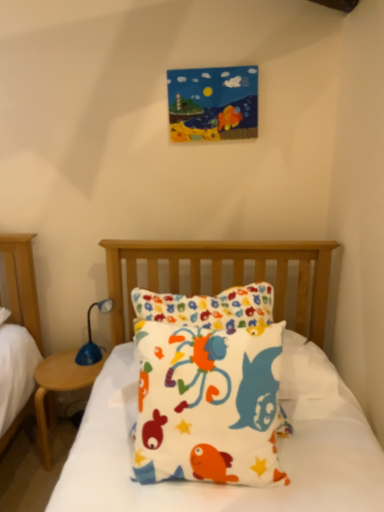
Question: From a real-world perspective, does wooden at left stand above blue plastic table lamp at left?

Choices:
 (A) no
 (B) yes

Answer: (A)

Question: Is wooden at left outside of blue plastic table lamp at left?

Choices:
 (A) no
 (B) yes

Answer: (B)

Question: Is wooden at left not close to blue plastic table lamp at left?

Choices:
 (A) yes
 (B) no

Answer: (B)

Question: Is blue plastic table lamp at left completely or partially inside wooden at left?

Choices:
 (A) yes
 (B) no

Answer: (B)

Question: Does wooden at left come behind blue plastic table lamp at left?

Choices:
 (A) no
 (B) yes

Answer: (A)

Question: Is wooden at left facing away from blue plastic table lamp at left?

Choices:
 (A) yes
 (B) no

Answer: (B)

Question: Is fluffy cotton pillow at center at the right side of wooden at left?

Choices:
 (A) no
 (B) yes

Answer: (B)

Question: Is fluffy cotton pillow at center positioned with its back to wooden at left?

Choices:
 (A) no
 (B) yes

Answer: (A)

Question: Is fluffy cotton pillow at center outside wooden at left?

Choices:
 (A) yes
 (B) no

Answer: (A)

Question: From a real-world perspective, is fluffy cotton pillow at center positioned over wooden at left based on gravity?

Choices:
 (A) no
 (B) yes

Answer: (B)

Question: Is fluffy cotton pillow at center taller than wooden at left?

Choices:
 (A) yes
 (B) no

Answer: (A)

Question: Does fluffy cotton pillow at center appear on the left side of wooden at left?

Choices:
 (A) no
 (B) yes

Answer: (A)

Question: Does blue plastic table lamp at left have a greater width compared to wooden at left?

Choices:
 (A) yes
 (B) no

Answer: (B)